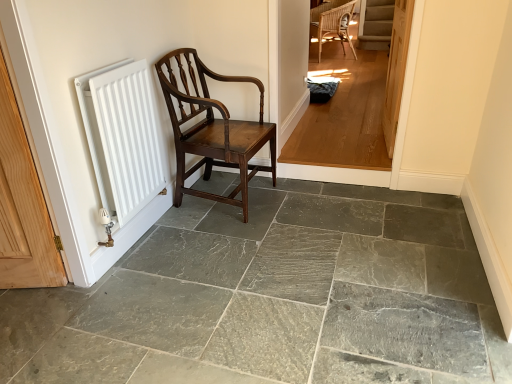
Question: Should I look upward or downward to see gray slate floor at center?

Choices:
 (A) up
 (B) down

Answer: (B)

Question: Considering the relative sizes of white matte radiator at left and polished dark wood chair at left in the image provided, is white matte radiator at left thinner than polished dark wood chair at left?

Choices:
 (A) yes
 (B) no

Answer: (A)

Question: Can you confirm if white matte radiator at left is taller than polished dark wood chair at left?

Choices:
 (A) yes
 (B) no

Answer: (B)

Question: Does white matte radiator at left have a lesser height compared to polished dark wood chair at left?

Choices:
 (A) no
 (B) yes

Answer: (B)

Question: Is white matte radiator at left facing away from polished dark wood chair at left?

Choices:
 (A) no
 (B) yes

Answer: (A)

Question: Can you confirm if white matte radiator at left is positioned to the left of polished dark wood chair at left?

Choices:
 (A) no
 (B) yes

Answer: (B)

Question: From a real-world perspective, is white matte radiator at left positioned under polished dark wood chair at left based on gravity?

Choices:
 (A) no
 (B) yes

Answer: (A)

Question: From the image's perspective, is light brown wood floor at center below gray slate floor at center?

Choices:
 (A) no
 (B) yes

Answer: (A)

Question: Is gray slate floor at center surrounded by light brown wood floor at center?

Choices:
 (A) no
 (B) yes

Answer: (A)

Question: Considering the relative positions of light brown wood floor at center and gray slate floor at center in the image provided, is light brown wood floor at center to the right of gray slate floor at center from the viewer's perspective?

Choices:
 (A) no
 (B) yes

Answer: (B)

Question: Is light brown wood floor at center behind gray slate floor at center?

Choices:
 (A) yes
 (B) no

Answer: (A)

Question: From a real-world perspective, is light brown wood floor at center under gray slate floor at center?

Choices:
 (A) yes
 (B) no

Answer: (B)

Question: Is light brown wood floor at center completely or partially outside of gray slate floor at center?

Choices:
 (A) no
 (B) yes

Answer: (B)

Question: Is polished dark wood chair at left shorter than white matte radiator at left?

Choices:
 (A) no
 (B) yes

Answer: (A)